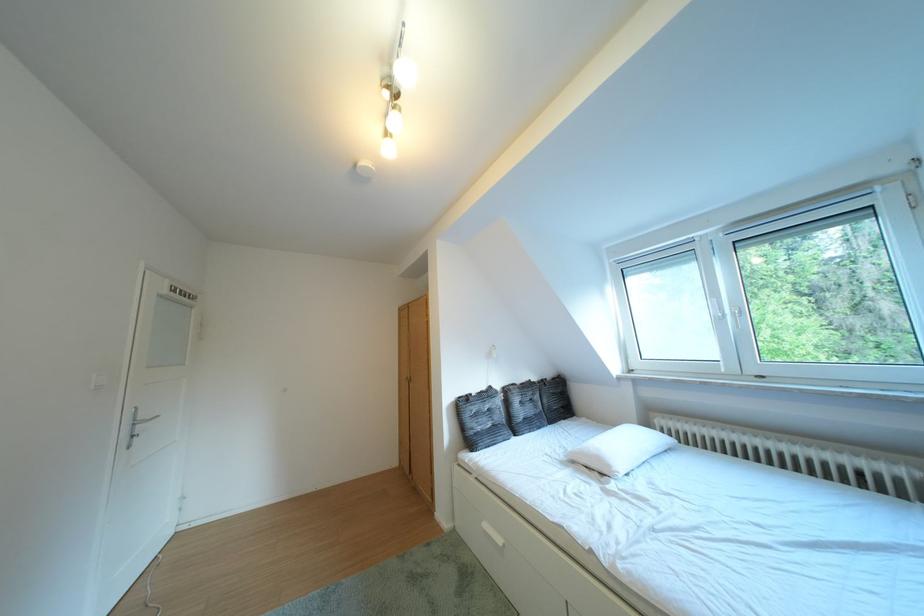
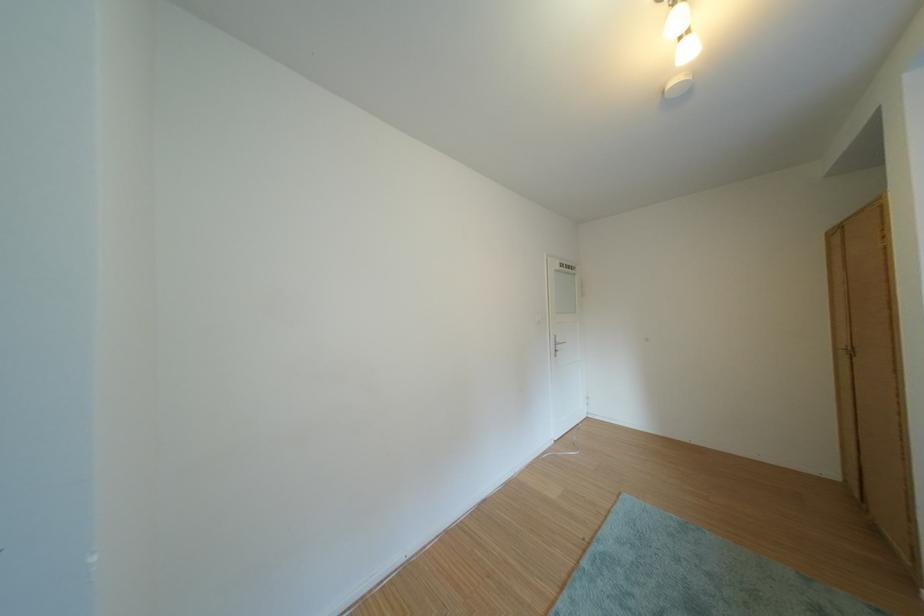
Question: The first image is from the beginning of the video and the second image is from the end. How did the camera likely rotate when shooting the video?

Choices:
 (A) Left
 (B) Right
 (C) Up
 (D) Down

Answer: (A)